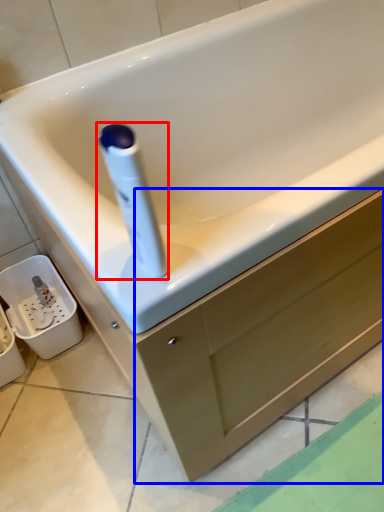
Question: Which object appears farthest to the camera in this image, cleaning product (highlighted by a red box) or drawer (highlighted by a blue box)?

Choices:
 (A) cleaning product
 (B) drawer

Answer: (B)